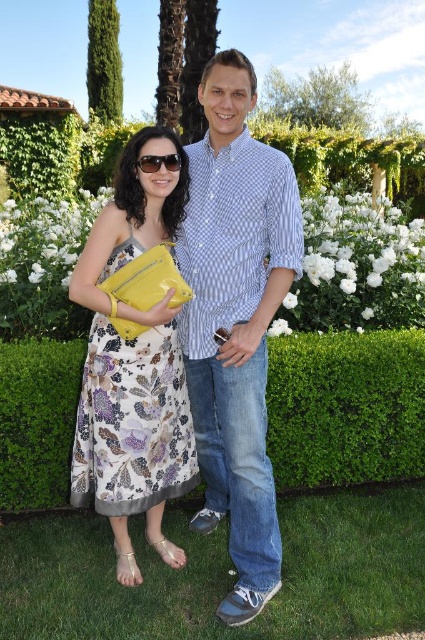
Question: Which is farther from the shiny black sunglasses at center?

Choices:
 (A) printed silk dress at center
 (B) green grass at lower center
 (C) blue checkered shirt at center
 (D) green leafy hedge at center

Answer: (B)

Question: Which of the following is the farthest from the observer?

Choices:
 (A) (342, 637)
 (B) (167, 333)
 (C) (209, 116)

Answer: (B)

Question: Is blue checkered shirt at center above green leafy hedge at center?

Choices:
 (A) yes
 (B) no

Answer: (A)

Question: Which object is the closest to the shiny black sunglasses at center?

Choices:
 (A) printed silk dress at center
 (B) blue checkered shirt at center
 (C) green grass at lower center
 (D) green leafy hedge at center

Answer: (B)

Question: Is green leafy hedge at center smaller than shiny black sunglasses at center?

Choices:
 (A) no
 (B) yes

Answer: (A)

Question: Can you confirm if blue checkered shirt at center is thinner than printed silk dress at center?

Choices:
 (A) yes
 (B) no

Answer: (A)